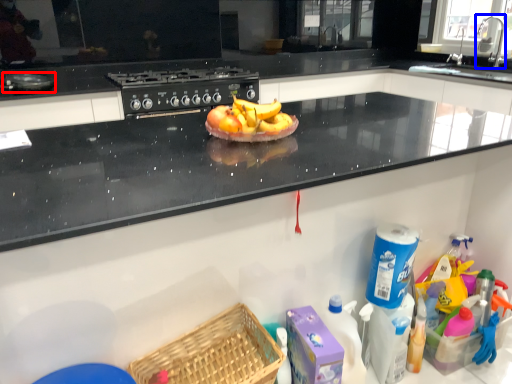
Question: Which object appears farthest to the camera in this image, appliance (highlighted by a red box) or faucet (highlighted by a blue box)?

Choices:
 (A) appliance
 (B) faucet

Answer: (B)